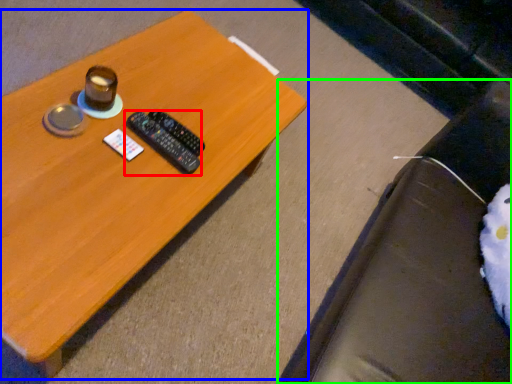
Question: Which object is the closest to the remote control (highlighted by a red box)? Choose among these: table (highlighted by a blue box) or bean bag chair (highlighted by a green box).

Choices:
 (A) table
 (B) bean bag chair

Answer: (A)